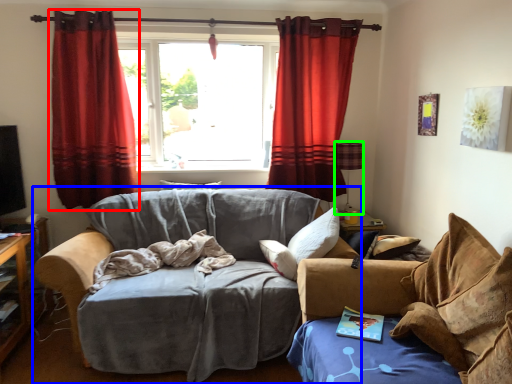
Question: Considering the real-world distances, which object is closest to curtain (highlighted by a red box)? studio couch (highlighted by a blue box) or lamp (highlighted by a green box).

Choices:
 (A) studio couch
 (B) lamp

Answer: (A)